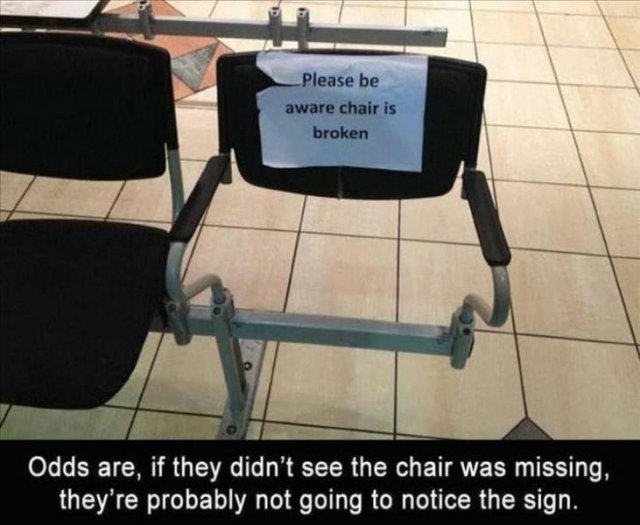
The image size is (640, 525). What are the coordinates of `tile` in the screenshot? It's located at pyautogui.click(x=577, y=286).